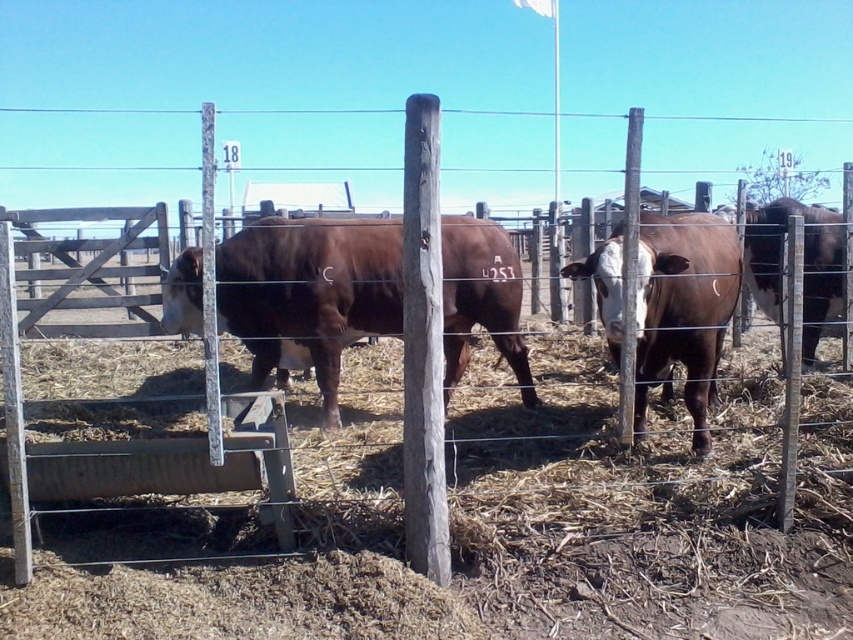
You are a farmer checking the enclosure. You notice the brown smooth cow at center and the gray weathered wood post at center. Which object takes up more space in the image?

The brown smooth cow at center has a larger size compared to the gray weathered wood post at center, so it takes up more space in the image.